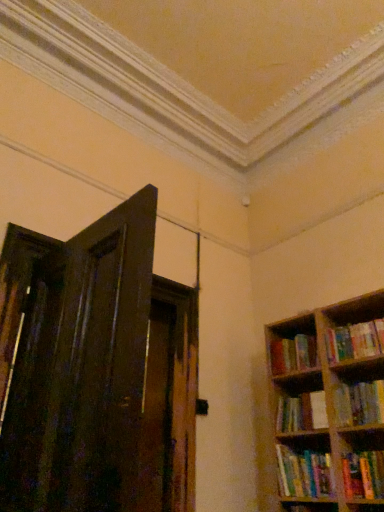
Question: Does hardcover book at right, placed as the third book when sorted from top to bottom, have a lesser width compared to hardcover books at right, which is the 1th book from top to bottom?

Choices:
 (A) yes
 (B) no

Answer: (A)

Question: Can you confirm if hardcover book at right, marked as the third book in a bottom-to-top arrangement, is bigger than hardcover books at right, which is the 1th book from top to bottom?

Choices:
 (A) no
 (B) yes

Answer: (A)

Question: Is the position of hardcover book at right, placed as the third book when sorted from top to bottom, more distant than that of hardcover books at right, which is the 1th book from top to bottom?

Choices:
 (A) yes
 (B) no

Answer: (B)

Question: Is hardcover book at right, marked as the third book in a bottom-to-top arrangement, positioned beyond the bounds of hardcover books at right, the fifth book in the bottom-to-top sequence?

Choices:
 (A) yes
 (B) no

Answer: (A)

Question: Is hardcover book at right, placed as the third book when sorted from top to bottom, directly adjacent to hardcover books at right, which is the 1th book from top to bottom?

Choices:
 (A) no
 (B) yes

Answer: (A)

Question: From their relative heights in the image, would you say hardcover book at right, arranged as the first book when ordered from the bottom, is taller or shorter than hardcover book at right, which is the fourth book in top-to-bottom order?

Choices:
 (A) tall
 (B) short

Answer: (A)

Question: Visually, is hardcover book at right, arranged as the first book when ordered from the bottom, positioned to the left or to the right of hardcover book at right, which is the fourth book in top-to-bottom order?

Choices:
 (A) right
 (B) left

Answer: (A)

Question: Which is correct: hardcover book at right, which is the fifth book from top to bottom, is inside hardcover book at right, arranged as the second book when ordered from the bottom, or outside of it?

Choices:
 (A) outside
 (B) inside

Answer: (A)

Question: Is hardcover book at right, arranged as the first book when ordered from the bottom, bigger or smaller than hardcover book at right, arranged as the second book when ordered from the bottom?

Choices:
 (A) small
 (B) big

Answer: (B)

Question: Considering the positions of point (311, 413) and point (324, 472), is point (311, 413) closer or farther from the camera than point (324, 472)?

Choices:
 (A) farther
 (B) closer

Answer: (A)

Question: In terms of height, does hardcover book at right, which is the fourth book in top-to-bottom order, look taller or shorter compared to hardcover book at right, arranged as the first book when ordered from the bottom?

Choices:
 (A) tall
 (B) short

Answer: (B)

Question: Considering the positions of hardcover book at right, which is the fourth book in top-to-bottom order, and hardcover book at right, which is the fifth book from top to bottom, in the image, is hardcover book at right, which is the fourth book in top-to-bottom order, bigger or smaller than hardcover book at right, which is the fifth book from top to bottom,?

Choices:
 (A) small
 (B) big

Answer: (A)

Question: Is hardcover book at right, which is the fourth book in top-to-bottom order, in front of or behind hardcover book at right, which is the fifth book from top to bottom, in the image?

Choices:
 (A) behind
 (B) front

Answer: (A)

Question: From the image's perspective, is hardcover books at right, the fifth book in the bottom-to-top sequence, positioned above or below hardcover book at right, marked as the third book in a bottom-to-top arrangement?

Choices:
 (A) below
 (B) above

Answer: (B)

Question: Looking at the image, does hardcover books at right, which is the 1th book from top to bottom, seem bigger or smaller compared to hardcover book at right, placed as the third book when sorted from top to bottom?

Choices:
 (A) small
 (B) big

Answer: (B)